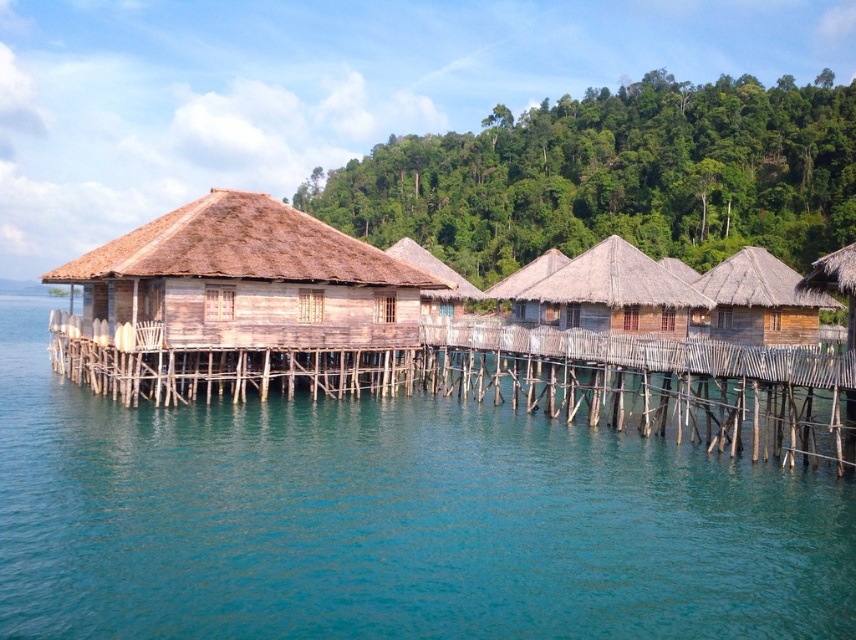
You are a delivery person carrying a package that requires a path between the brown wooden hut at right and the wooden thatched hut at right. The package needs a clear path at least 5 meters wide. Can you safely navigate through the space between them?

The distance between the brown wooden hut at right and the wooden thatched hut at right is 4.69 meters, which is narrower than the required 5 meters. Therefore, the path is not wide enough to safely navigate with the package.

You are standing on the wooden dock at center. Looking towards the direction of the point marked at coordinates (520, 381), which object in the scene would you see directly in front of you?

The wooden dock at center is represented by the point marked at coordinates (520, 381), so standing on it and looking towards those coordinates would mean you are looking directly at the wooden dock itself.